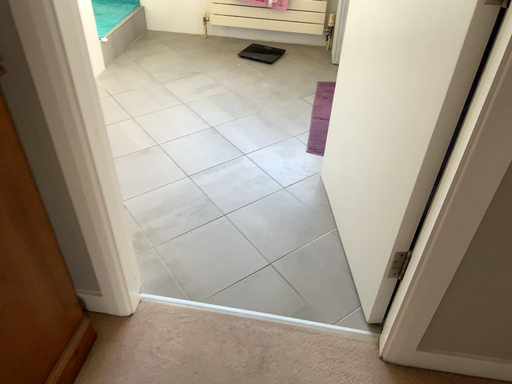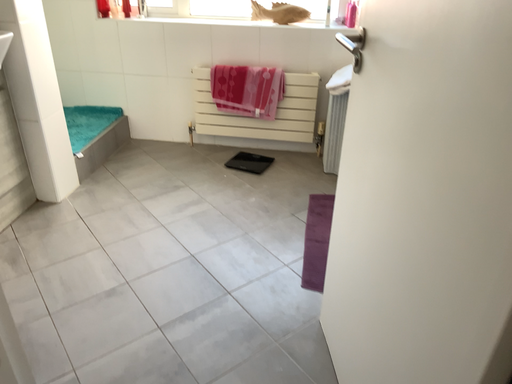
Question: Which way did the camera rotate in the video?

Choices:
 (A) rotated downward
 (B) rotated upward

Answer: (B)